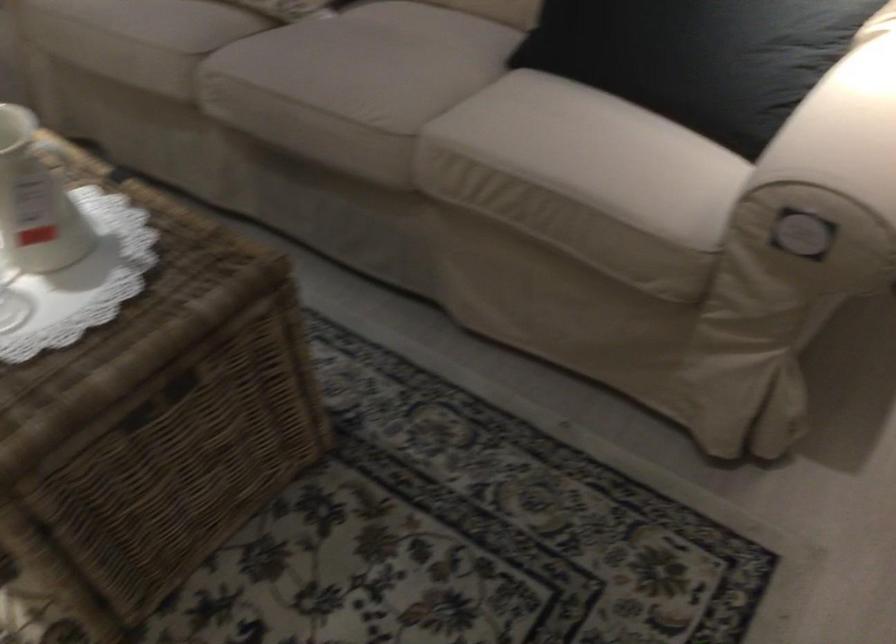
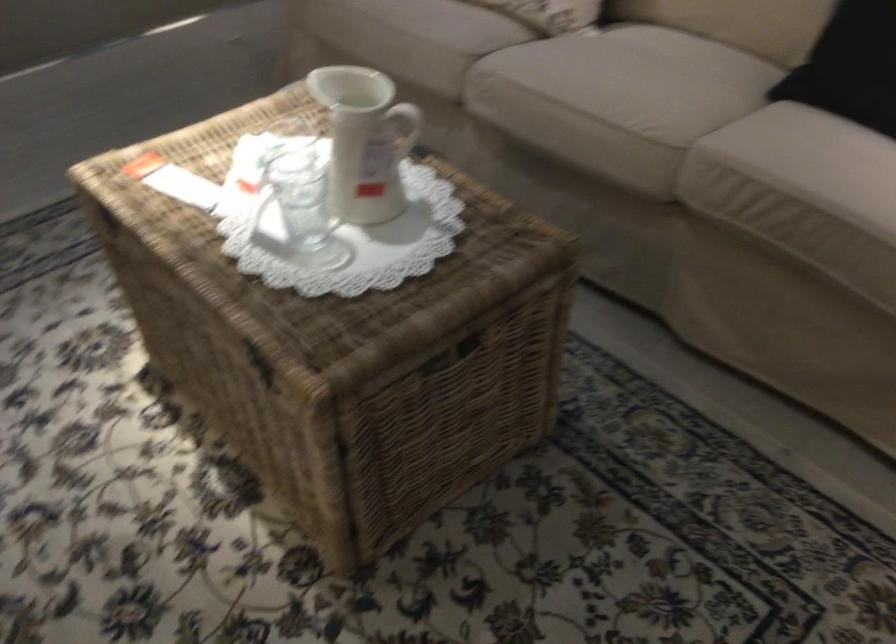
Locate, in the second image, the point that corresponds to point 345,84 in the first image.

(617, 93)